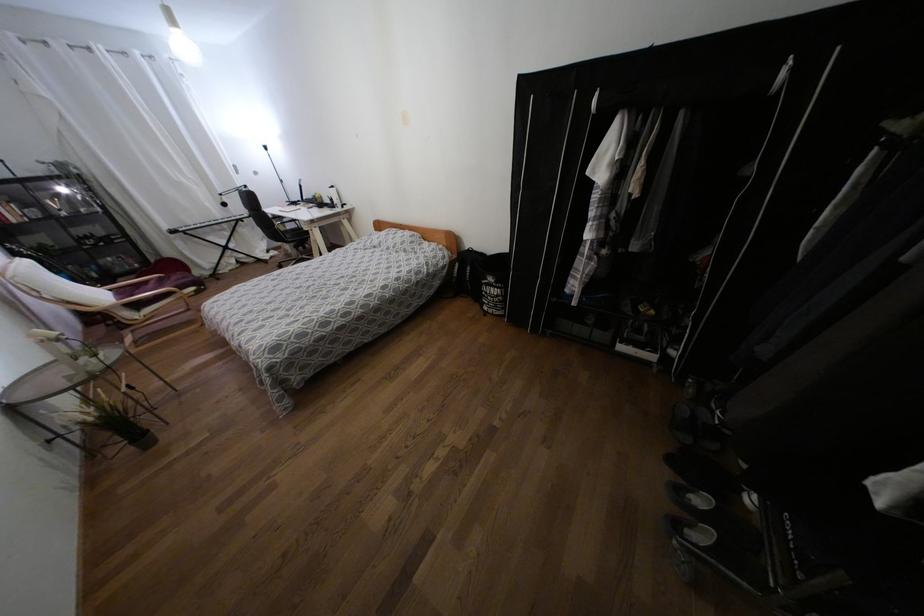
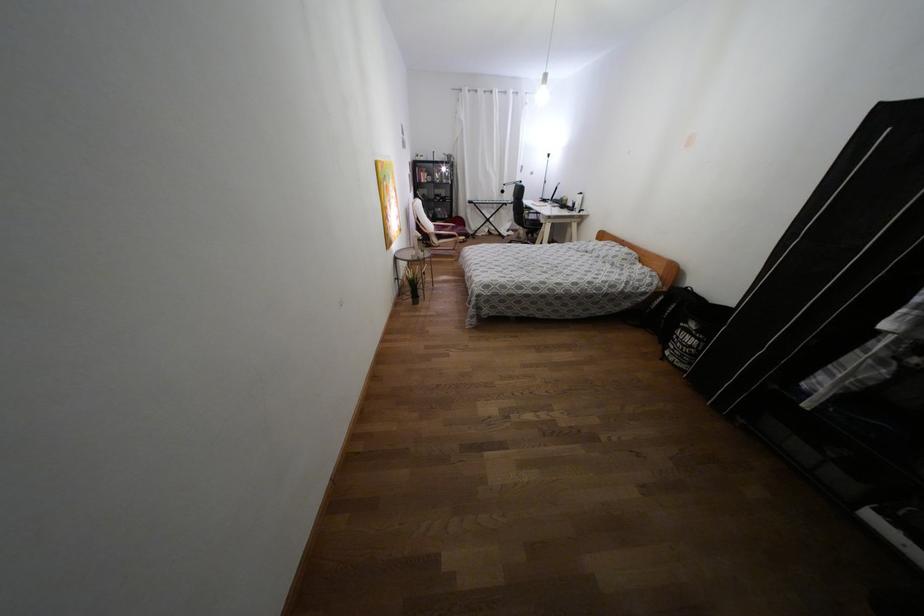
The point at (137, 306) is marked in the first image. Where is the corresponding point in the second image?

(439, 237)